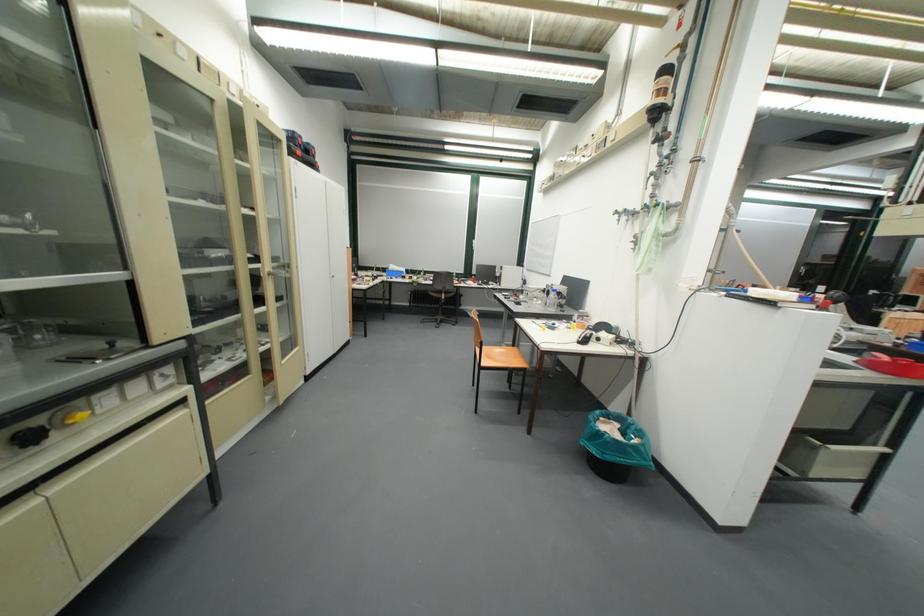
Where is `recessed cabinet handle`? The height and width of the screenshot is (616, 924). recessed cabinet handle is located at coordinates (270, 272).